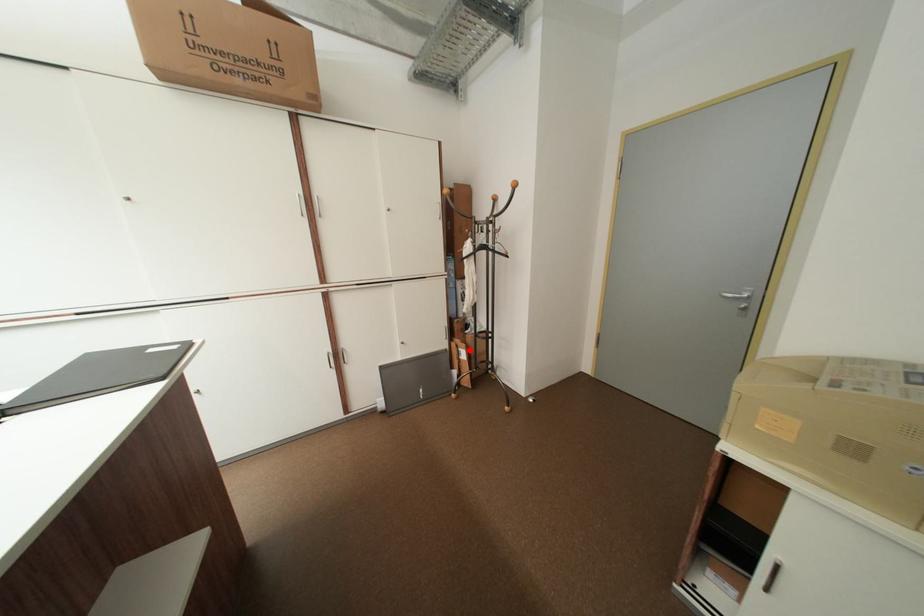
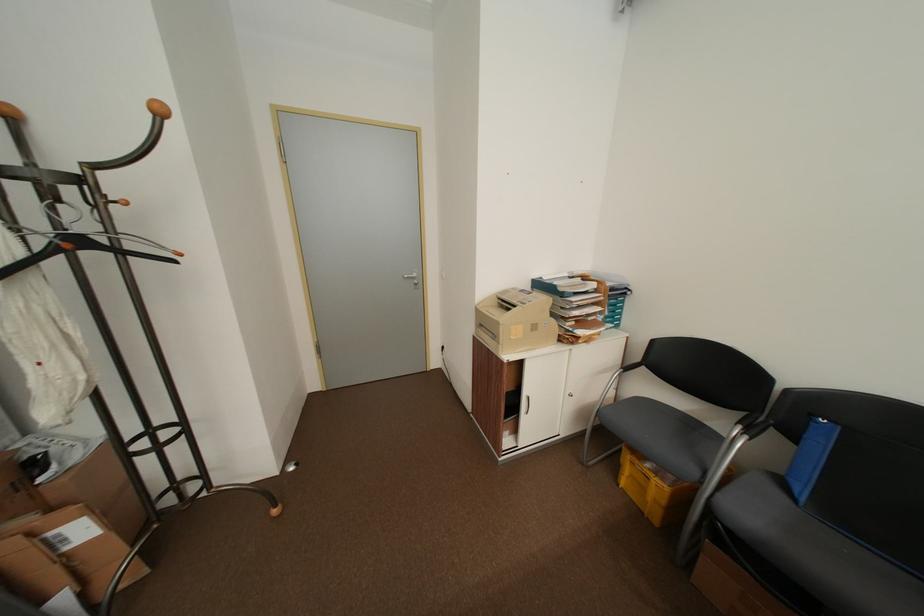
Find the pixel in the second image that matches the highlighted location in the first image.

(63, 533)